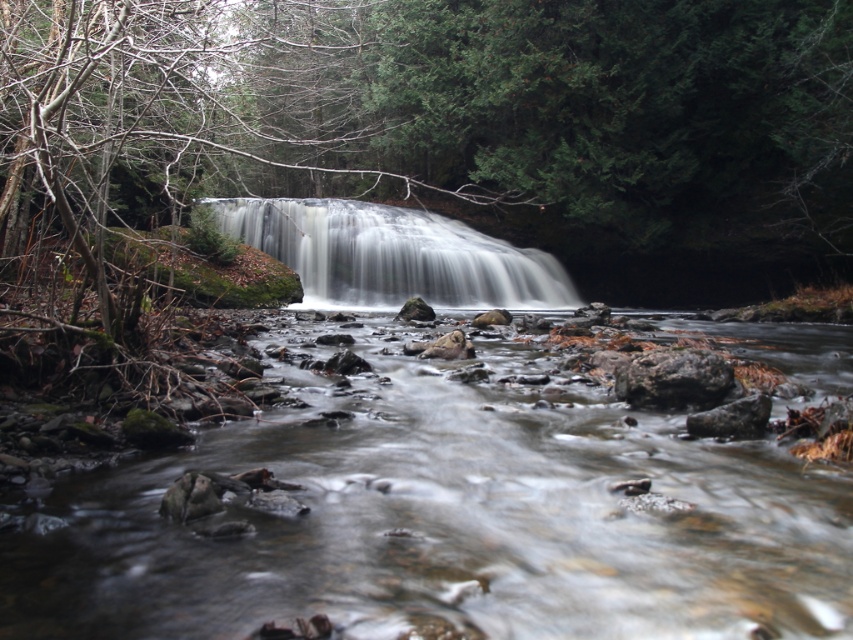
Does point (289, 212) come behind point (699, 372)?

Yes, point (289, 212) is farther from viewer.

Describe the element at coordinates (393, 256) in the screenshot. This screenshot has height=640, width=853. I see `white smooth waterfall at center` at that location.

Locate an element on the screen. Image resolution: width=853 pixels, height=640 pixels. white smooth waterfall at center is located at coordinates (393, 256).

Can you confirm if clear water at center is positioned above white smooth waterfall at center?

No, clear water at center is not above white smooth waterfall at center.

Can you confirm if clear water at center is wider than white smooth waterfall at center?

No, clear water at center is not wider than white smooth waterfall at center.

Is point (514, 454) closer to viewer compared to point (538, 252)?

Yes, point (514, 454) is in front of point (538, 252).

This screenshot has width=853, height=640. In order to click on clear water at center in this screenshot , I will do `click(450, 520)`.

Between clear water at center and rough textured rock at center, which one is positioned lower?

clear water at center

Is clear water at center in front of rough textured rock at center?

Yes, it is.

What are the coordinates of `clear water at center` in the screenshot? It's located at [x=450, y=520].